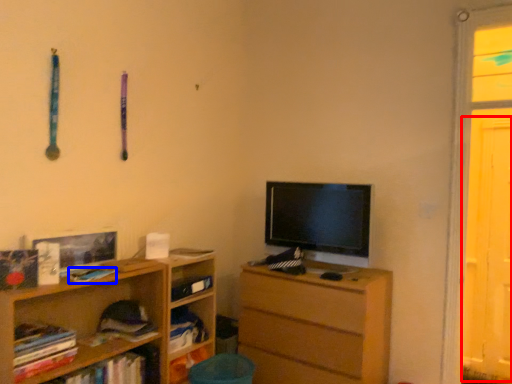
Question: Which object appears farthest to the camera in this image, screen door (highlighted by a red box) or book (highlighted by a blue box)?

Choices:
 (A) screen door
 (B) book

Answer: (A)